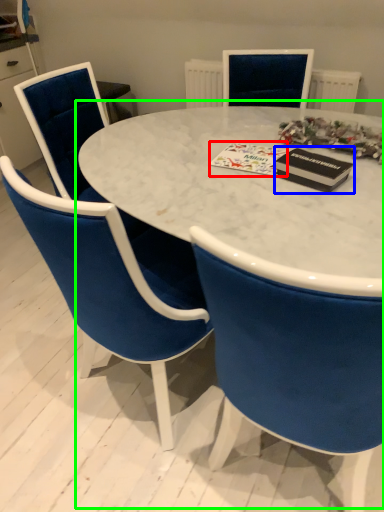
Question: Based on their relative distances, which object is farther from christmas card (highlighted by a red box)? Choose from magazine (highlighted by a blue box) and table (highlighted by a green box).

Choices:
 (A) magazine
 (B) table

Answer: (B)